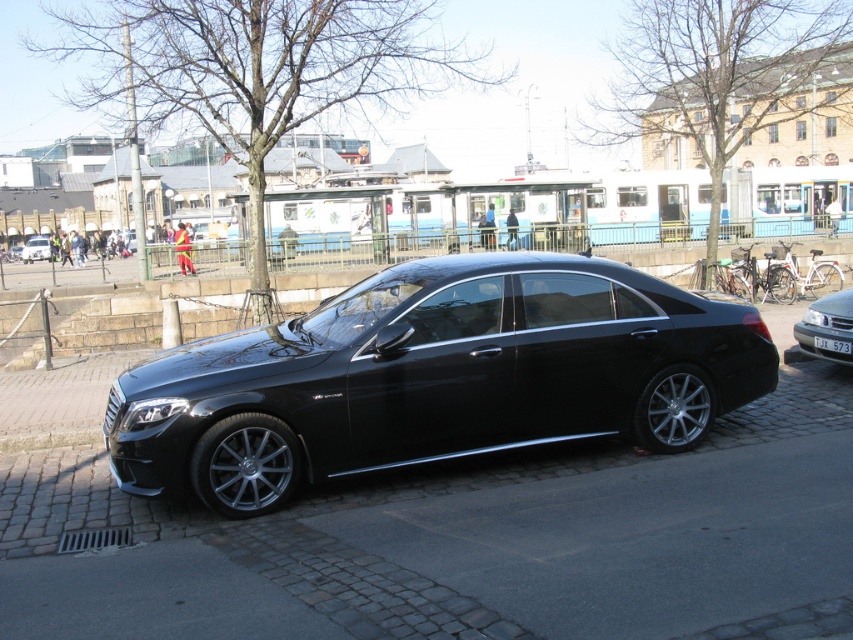
Can you confirm if black metallic sedan at center is positioned above black plastic license plate at center?

Yes, black metallic sedan at center is above black plastic license plate at center.

At what (x,y) coordinates should I click in order to perform the action: click on black metallic sedan at center. Please return your answer as a coordinate pair (x, y). Looking at the image, I should click on (827, 326).

Can you confirm if black asphalt at center is shorter than glossy black car at center?

Indeed, black asphalt at center has a lesser height compared to glossy black car at center.

Can you confirm if black asphalt at center is positioned to the right of glossy black car at center?

Indeed, black asphalt at center is positioned on the right side of glossy black car at center.

Is point (496, 550) positioned in front of point (404, 342)?

Yes, it is.

Identify the location of black asphalt at center. This screenshot has height=640, width=853. (466, 541).

Can you confirm if glossy black car at center is bigger than shiny black sedan at center?

No, glossy black car at center is not bigger than shiny black sedan at center.

Who is more distant from viewer, [447,352] or [51,252]?

Positioned behind is point [51,252].

Does point (260, 484) come behind point (35, 252)?

No, it is not.

The width and height of the screenshot is (853, 640). Find the location of `glossy black car at center`. glossy black car at center is located at coordinates (434, 376).